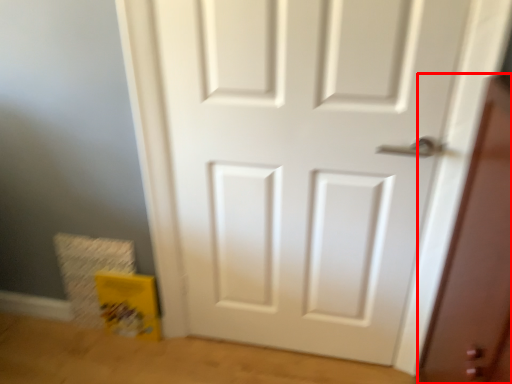
Question: From the image's perspective, where is screen door (annotated by the red box) located in relation to door in the image?

Choices:
 (A) below
 (B) above

Answer: (A)